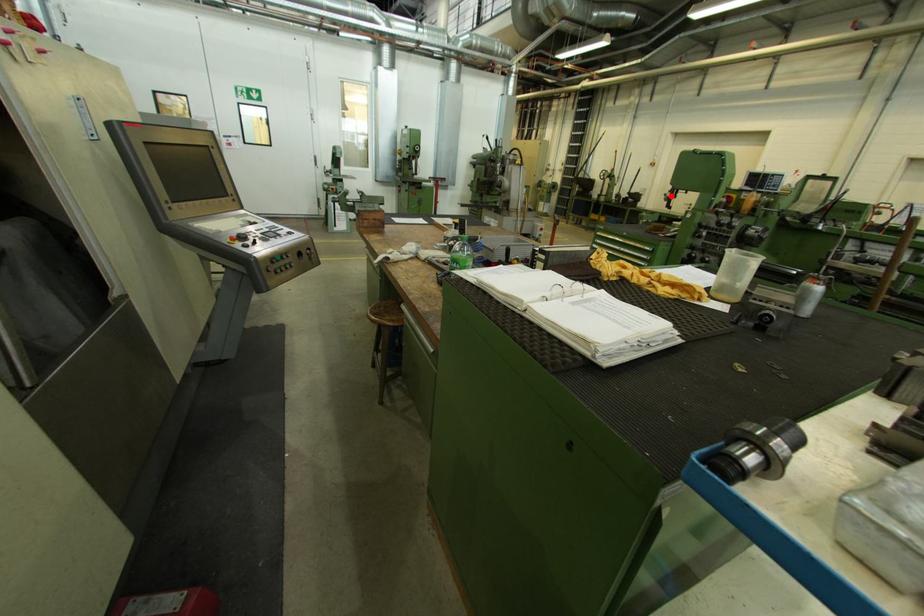
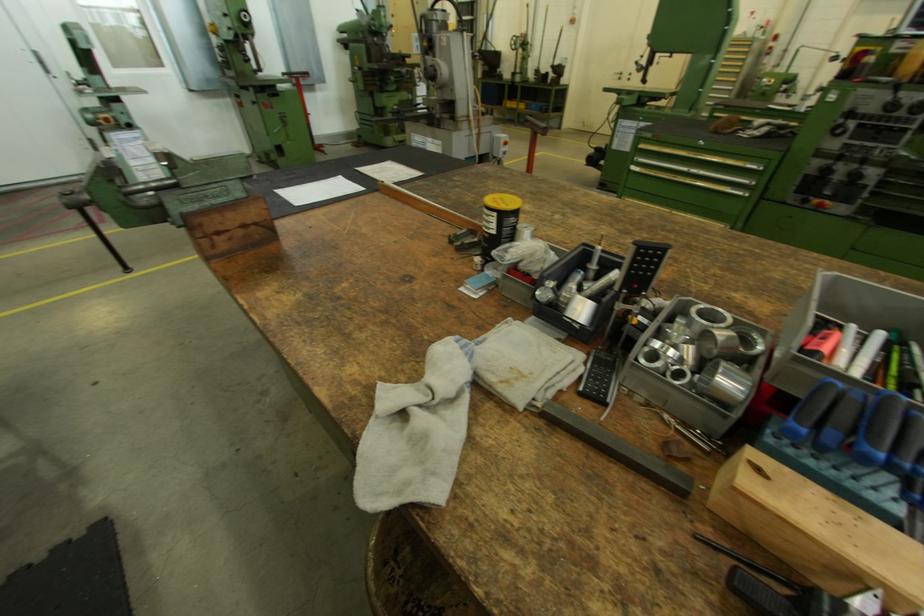
Locate, in the second image, the point that corresponds to the highlighted location in the first image.

(642, 63)